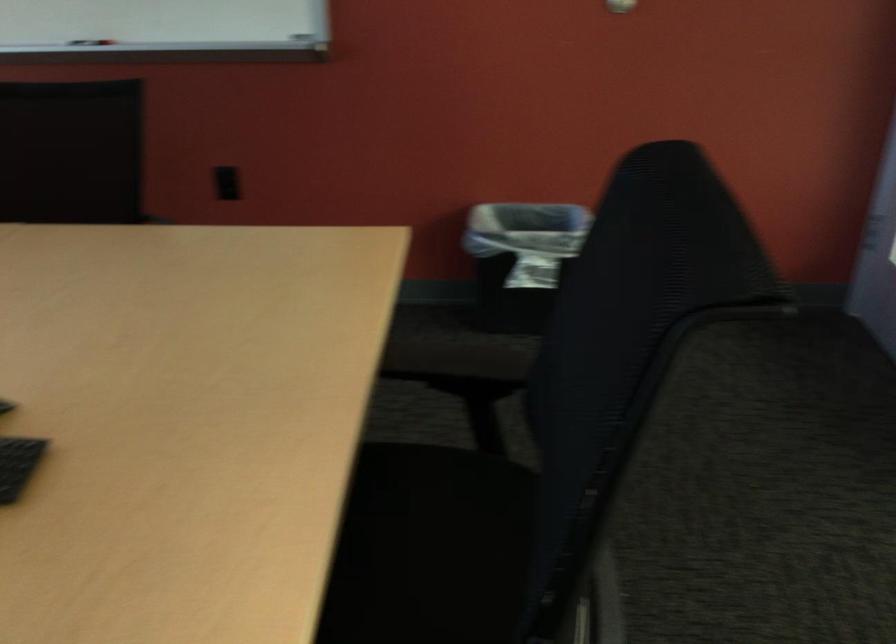
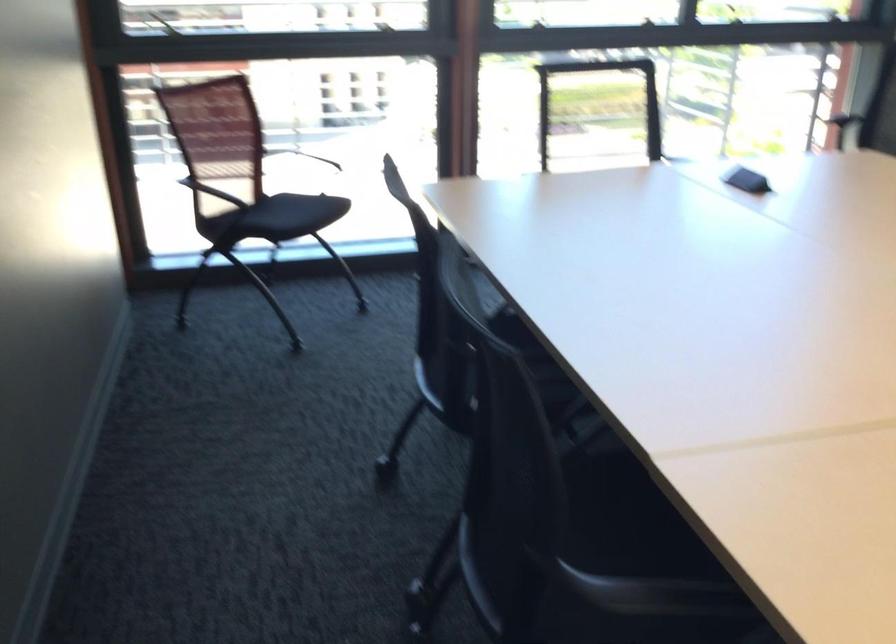
First-person continuous shooting, in which direction is the camera rotating?

The camera rotated toward left-down.